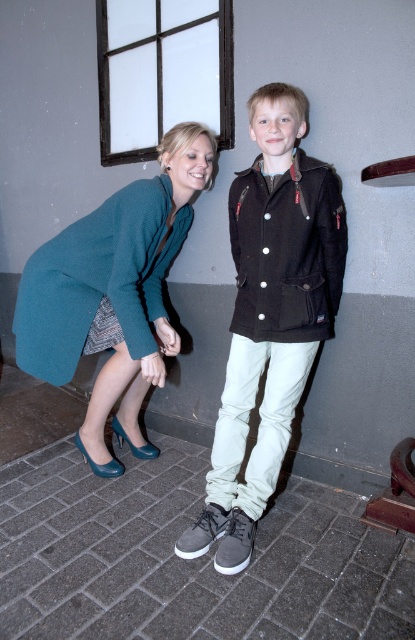
Question: Which object appears closest to the camera in this image?

Choices:
 (A) dark brown leather jacket at center
 (B) teal fabric coat at lower left

Answer: (A)

Question: Does dark brown leather jacket at center appear on the right side of teal fabric coat at lower left?

Choices:
 (A) no
 (B) yes

Answer: (B)

Question: Which of the following is the closest to the observer?

Choices:
 (A) (170, 244)
 (B) (283, 419)

Answer: (B)

Question: Is dark brown leather jacket at center above teal fabric coat at lower left?

Choices:
 (A) no
 (B) yes

Answer: (A)

Question: Is dark brown leather jacket at center positioned at the back of teal fabric coat at lower left?

Choices:
 (A) yes
 (B) no

Answer: (B)

Question: Which object appears closest to the camera in this image?

Choices:
 (A) dark brown leather jacket at center
 (B) teal fabric coat at lower left

Answer: (A)